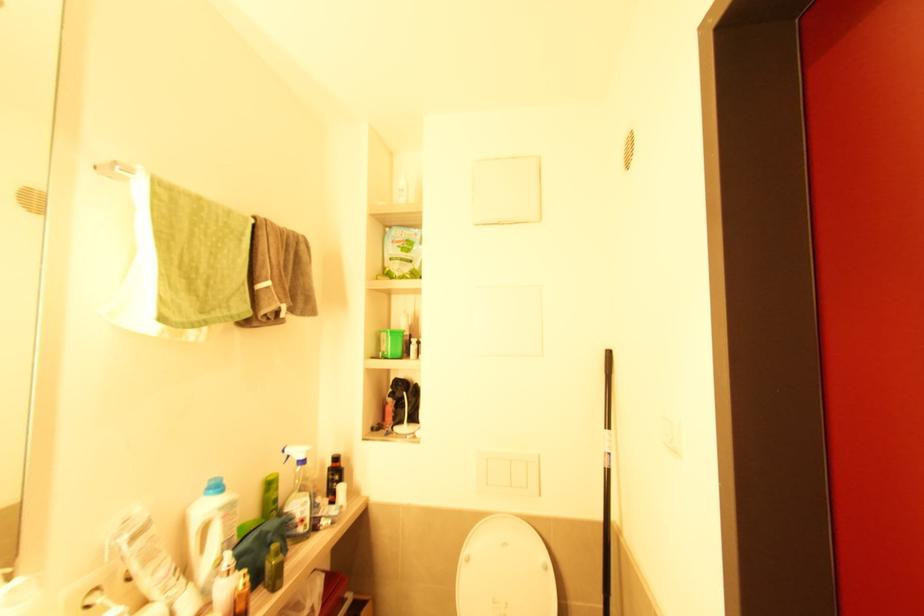
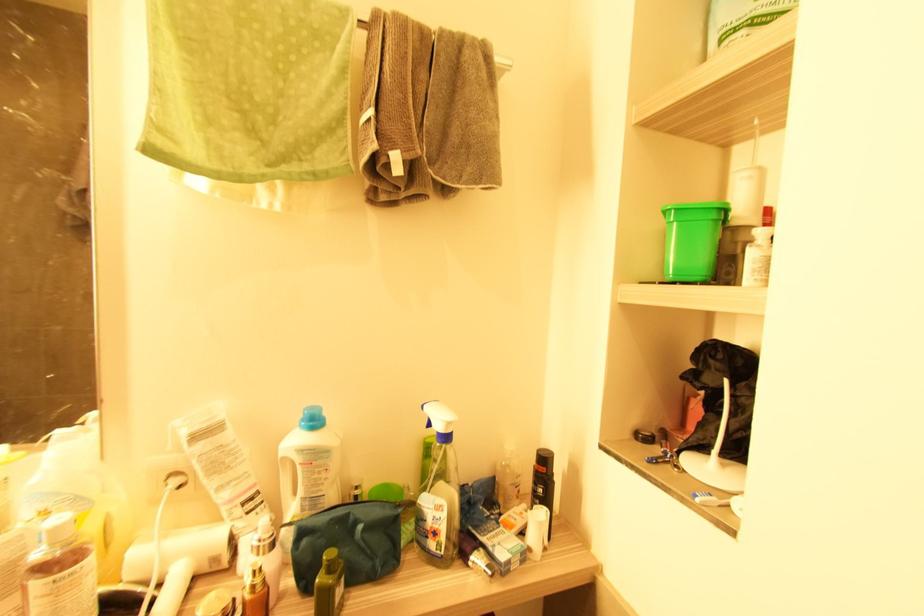
Find the pixel in the second image that matches pixel 416 346 in the first image.

(760, 246)